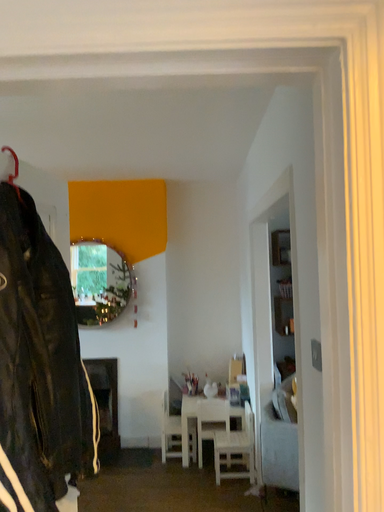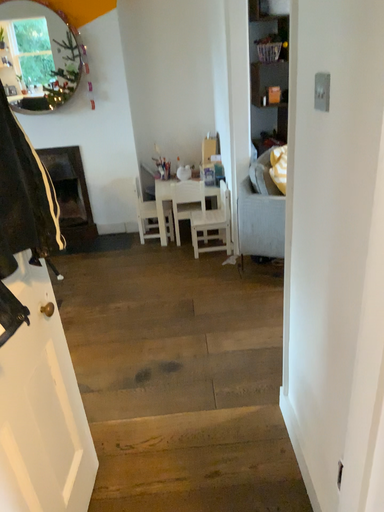
Question: Which way did the camera rotate in the video?

Choices:
 (A) rotated downward
 (B) rotated upward

Answer: (A)